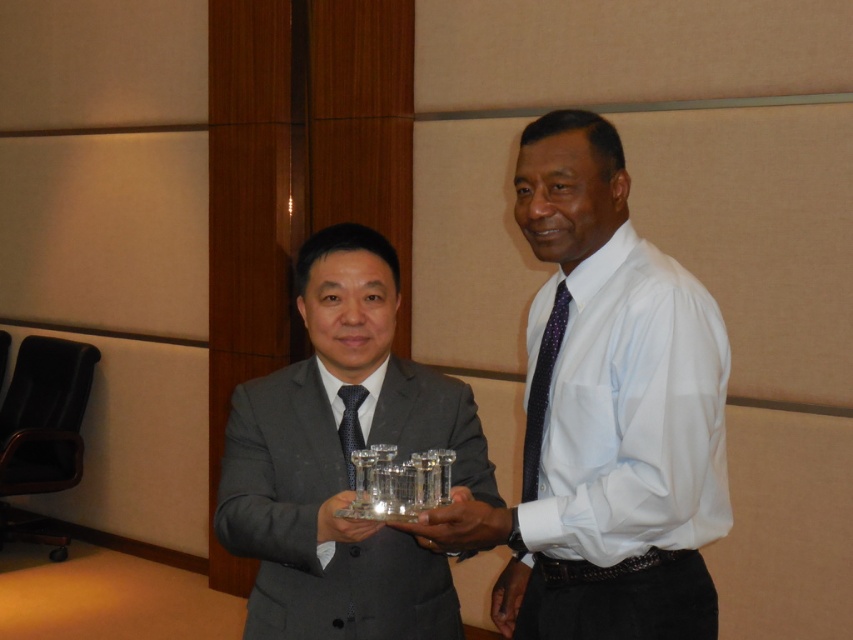
Question: Can you confirm if matte black suit at center is positioned to the right of purple dotted fabric tie at right?

Choices:
 (A) no
 (B) yes

Answer: (A)

Question: Which point appears farthest from the camera in this image?

Choices:
 (A) (344, 396)
 (B) (465, 541)
 (C) (561, 336)
 (D) (252, 388)

Answer: (D)

Question: Among these objects, which one is nearest to the camera?

Choices:
 (A) white glossy shirt at center
 (B) dark blue textured tie at center
 (C) purple dotted fabric tie at right

Answer: (A)

Question: Where is white glossy shirt at center located in relation to purple dotted fabric tie at right in the image?

Choices:
 (A) right
 (B) left

Answer: (A)

Question: Can you confirm if matte black suit at center is smaller than dark blue textured tie at center?

Choices:
 (A) yes
 (B) no

Answer: (B)

Question: Estimate the real-world distances between objects in this image. Which object is farther from the matte black suit at center?

Choices:
 (A) purple dotted fabric tie at right
 (B) white glossy shirt at center

Answer: (A)